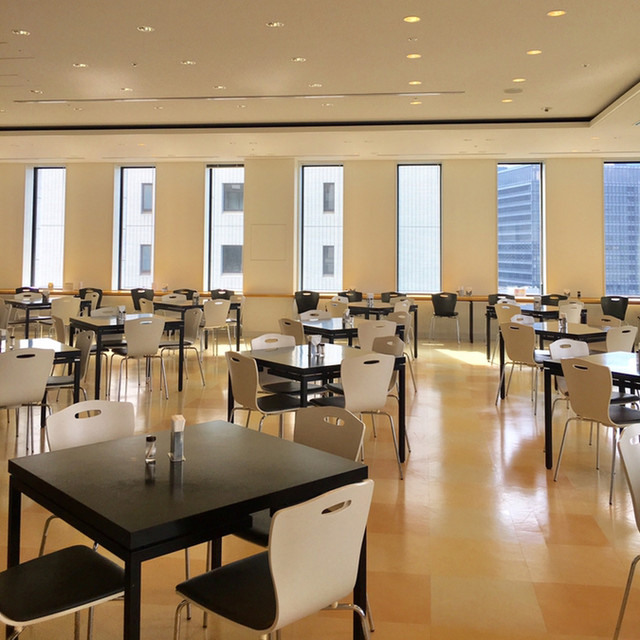
At what (x,y) coordinates should I click in order to perform the action: click on windows. Please return your answer as a coordinate pair (x, y). Image resolution: width=640 pixels, height=640 pixels. Looking at the image, I should click on (45, 185), (136, 186), (221, 182), (329, 175), (409, 195), (518, 207), (617, 214).